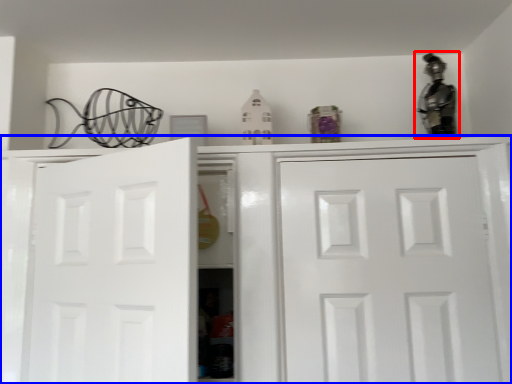
Question: Which object is further to the camera taking this photo, figurine (highlighted by a red box) or cabinetry (highlighted by a blue box)?

Choices:
 (A) figurine
 (B) cabinetry

Answer: (A)